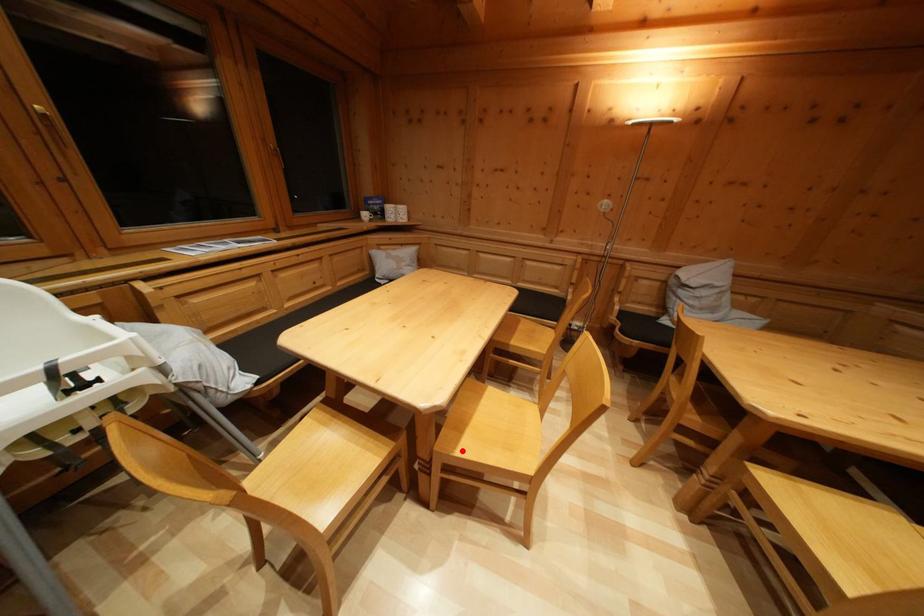
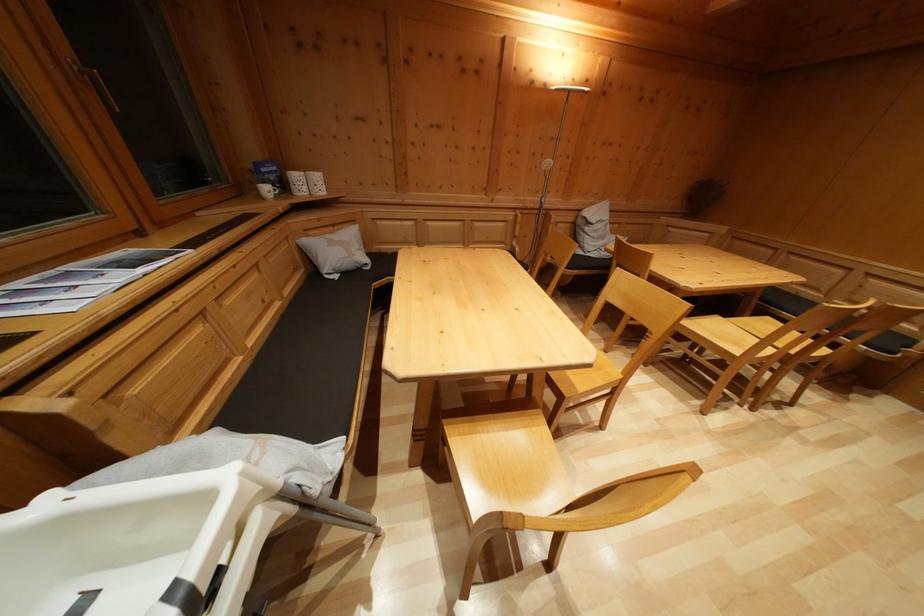
The point at the highlighted location is marked in the first image. Where is the corresponding point in the second image?

(578, 392)